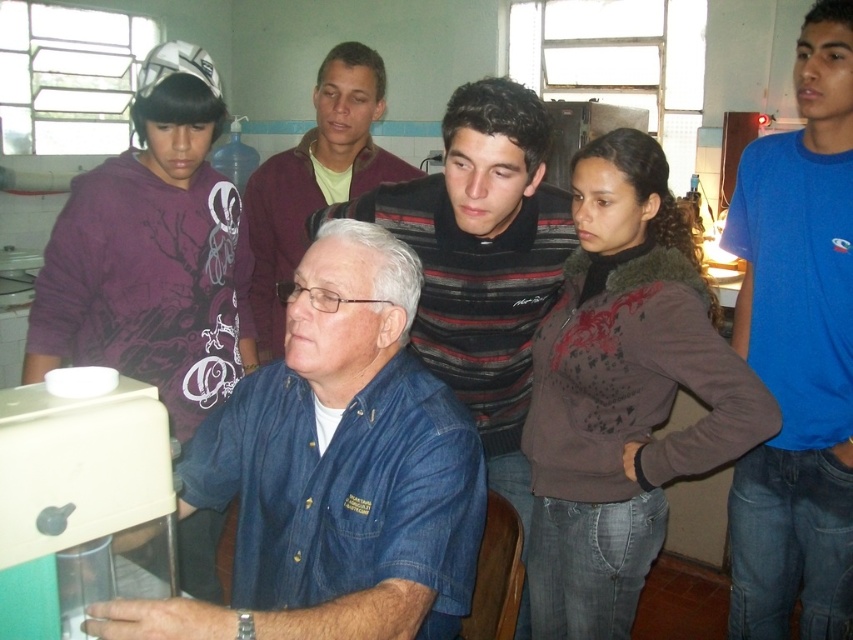
You are organizing a clothing donation drive and need to categorize items by size. You have two shirts in front of you, the striped sweater at upper center and the matte black shirt at center. Which one should you place in the large size bin?

The striped sweater at upper center has a larger size compared to matte black shirt at center, so it should be placed in the large size bin.

You are standing in the room and looking at the two points marked in the image. Which point, point (523, 637) or point (364, 74), is closer to you?

Point (523, 637) is closer to the camera than point (364, 74), so it is closer to you.

You are standing in the room and see the point at coordinate (335, 470). Which object is this point located on?

The point at coordinate (335, 470) is located on the denim shirt at center.